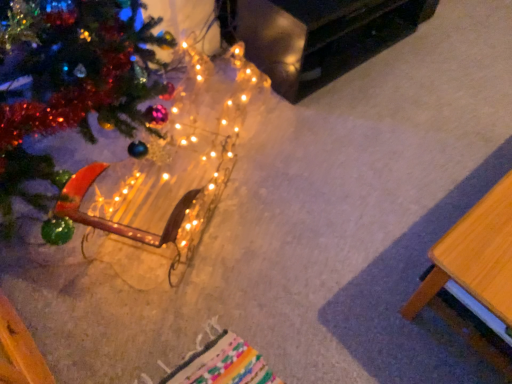
Question: Can you confirm if black glossy table at upper right, which is counted as the 2th table, starting from the bottom, is thinner than wooden table at lower right, which is counted as the first table, starting from the bottom?

Choices:
 (A) yes
 (B) no

Answer: (B)

Question: Considering the relative sizes of black glossy table at upper right, the second table in the front-to-back sequence, and wooden table at lower right, arranged as the 2th table when viewed from the top, in the image provided, is black glossy table at upper right, the second table in the front-to-back sequence, shorter than wooden table at lower right, arranged as the 2th table when viewed from the top,?

Choices:
 (A) yes
 (B) no

Answer: (A)

Question: Is the depth of black glossy table at upper right, which is the first table in top-to-bottom order, greater than that of wooden table at lower right, marked as the second table in a back-to-front arrangement?

Choices:
 (A) yes
 (B) no

Answer: (A)

Question: Considering the relative sizes of black glossy table at upper right, which is the first table in top-to-bottom order, and wooden table at lower right, marked as the second table in a back-to-front arrangement, in the image provided, is black glossy table at upper right, which is the first table in top-to-bottom order, bigger than wooden table at lower right, marked as the second table in a back-to-front arrangement,?

Choices:
 (A) no
 (B) yes

Answer: (B)

Question: From the image's perspective, is black glossy table at upper right, which is the first table in back-to-front order, over wooden table at lower right, marked as the 1th table in a front-to-back arrangement?

Choices:
 (A) yes
 (B) no

Answer: (A)

Question: Is black glossy table at upper right, which is the first table in back-to-front order, placed right next to wooden table at lower right, which is counted as the first table, starting from the bottom?

Choices:
 (A) no
 (B) yes

Answer: (A)

Question: Is illuminated wireframe horse at lower left positioned far away from black glossy table at upper right, which is the first table in back-to-front order?

Choices:
 (A) yes
 (B) no

Answer: (B)

Question: Is illuminated wireframe horse at lower left wider than black glossy table at upper right, which is the first table in back-to-front order?

Choices:
 (A) yes
 (B) no

Answer: (A)

Question: Is illuminated wireframe horse at lower left taller than black glossy table at upper right, the second table in the front-to-back sequence?

Choices:
 (A) yes
 (B) no

Answer: (B)

Question: Is black glossy table at upper right, the second table in the front-to-back sequence, at the back of illuminated wireframe horse at lower left?

Choices:
 (A) no
 (B) yes

Answer: (A)

Question: Is illuminated wireframe horse at lower left smaller than black glossy table at upper right, which is the first table in top-to-bottom order?

Choices:
 (A) yes
 (B) no

Answer: (B)

Question: Can you see illuminated wireframe horse at lower left touching black glossy table at upper right, the second table in the front-to-back sequence?

Choices:
 (A) yes
 (B) no

Answer: (B)

Question: Is wooden table at lower right, marked as the second table in a back-to-front arrangement, outside black glossy table at upper right, which is the first table in top-to-bottom order?

Choices:
 (A) no
 (B) yes

Answer: (B)